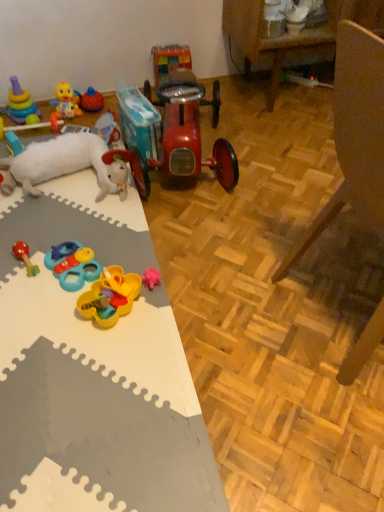
Where is `vacant area that lies between plastic/soft yellow and blue toy at lower left, the 4th toy viewed from the right, and rubber duck at left, arranged as the second toy when viewed from the left`? Image resolution: width=384 pixels, height=512 pixels. vacant area that lies between plastic/soft yellow and blue toy at lower left, the 4th toy viewed from the right, and rubber duck at left, arranged as the second toy when viewed from the left is located at coordinates (53, 217).